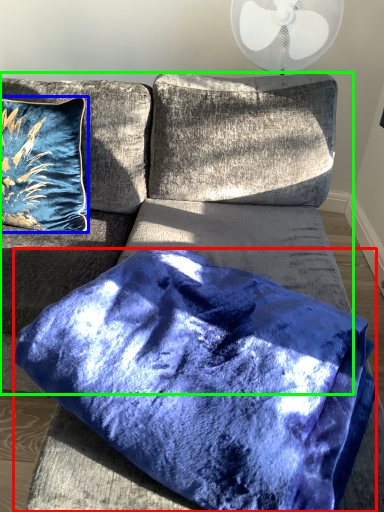
Question: Which is farther away from pillow (highlighted by a red box)? pillow (highlighted by a blue box) or couch (highlighted by a green box)?

Choices:
 (A) pillow
 (B) couch

Answer: (A)